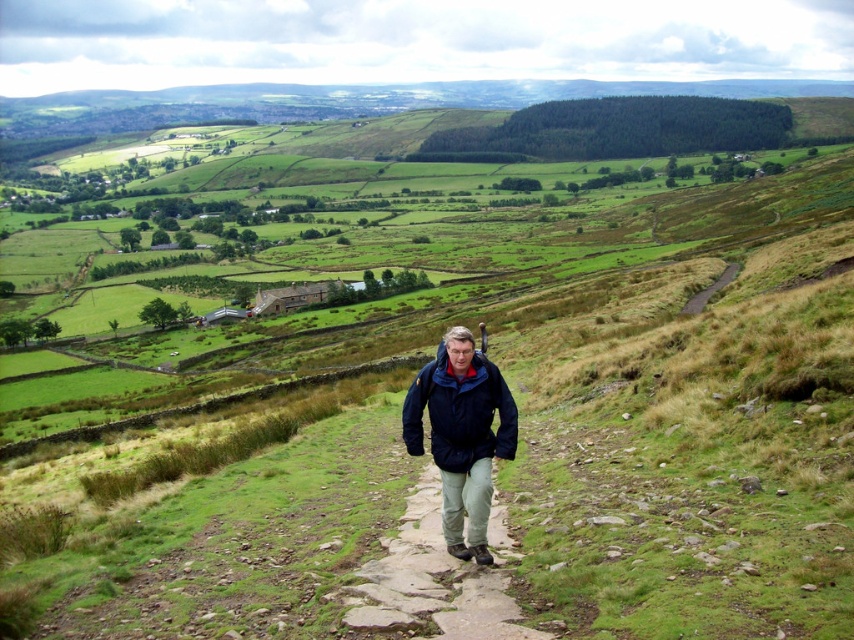
Question: Which point is closer to the camera?

Choices:
 (A) (486, 433)
 (B) (507, 580)

Answer: (B)

Question: Which object is farther from the camera taking this photo?

Choices:
 (A) navy blue jacket at center
 (B) stone paved path at center

Answer: (A)

Question: Does stone paved path at center have a lesser width compared to navy blue jacket at center?

Choices:
 (A) no
 (B) yes

Answer: (B)

Question: Can you confirm if stone paved path at center is thinner than navy blue jacket at center?

Choices:
 (A) yes
 (B) no

Answer: (A)

Question: Is stone paved path at center closer to the viewer compared to navy blue jacket at center?

Choices:
 (A) no
 (B) yes

Answer: (B)